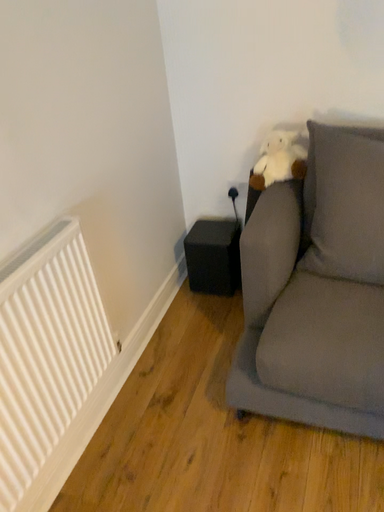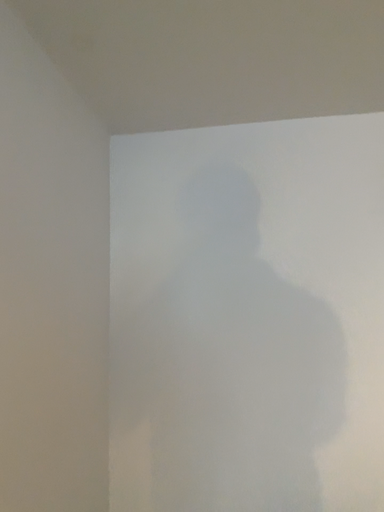
Question: Which way did the camera rotate in the video?

Choices:
 (A) rotated downward
 (B) rotated upward

Answer: (B)